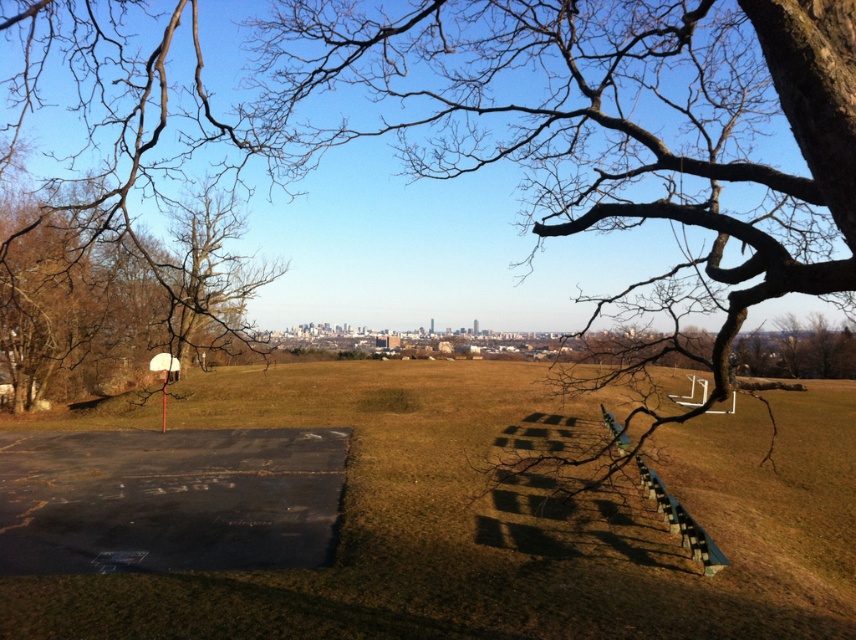
Question: Which object is positioned closest to the white matte basketball hoop at center-left?

Choices:
 (A) green grass at center
 (B) brown bark tree at left

Answer: (B)

Question: Does brown bark tree at left appear on the left side of white matte basketball hoop at center-left?

Choices:
 (A) no
 (B) yes

Answer: (B)

Question: Which of the following is the farthest from the observer?

Choices:
 (A) white matte basketball hoop at center-left
 (B) green grass at center

Answer: (A)

Question: Estimate the real-world distances between objects in this image. Which object is closer to the white matte basketball hoop at center-left?

Choices:
 (A) green grass at center
 (B) brown bark tree at left

Answer: (B)

Question: Considering the relative positions of green grass at center and brown bark tree at left in the image provided, where is green grass at center located with respect to brown bark tree at left?

Choices:
 (A) below
 (B) above

Answer: (A)

Question: From the image, what is the correct spatial relationship of brown bark tree at left in relation to white matte basketball hoop at center-left?

Choices:
 (A) right
 (B) left

Answer: (B)